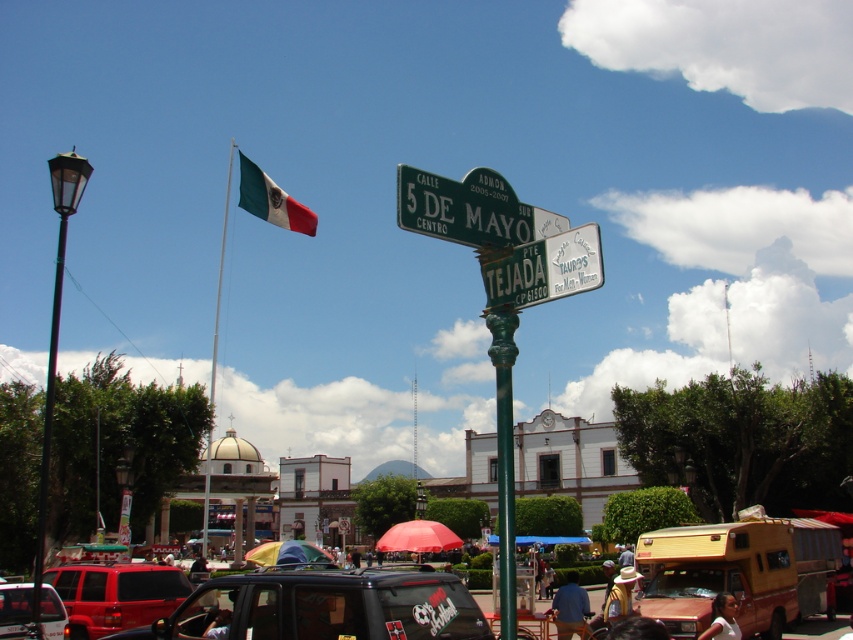
You are a photographer wanting to capture both the green metallic flagpole at upper left and the rainbow fabric umbrella at center in a single frame. Which object should you position closer to the edge of your camera frame to ensure both fit?

Since the green metallic flagpole at upper left is wider than the rainbow fabric umbrella at center, you should position the green metallic flagpole at upper left closer to the edge of your camera frame to ensure both fit in the frame.

You are a delivery driver who needs to know if your 2.5m tall truck can pass under the green metallic street sign at upper center without hitting the matte red suv at center. What should you consider?

The green metallic street sign at upper center has a greater height compared to the matte red suv at center. Since the truck is 2.5m tall, you should check the height of the green metallic street sign at upper center to ensure it is taller than 2.5 meters to safely pass underneath without hitting the matte red suv at center.

You are standing at the point marked by coordinates point (469, 209) in the image. What object is located exactly at that point?

The green metallic street sign at upper center is located exactly at point (469, 209).